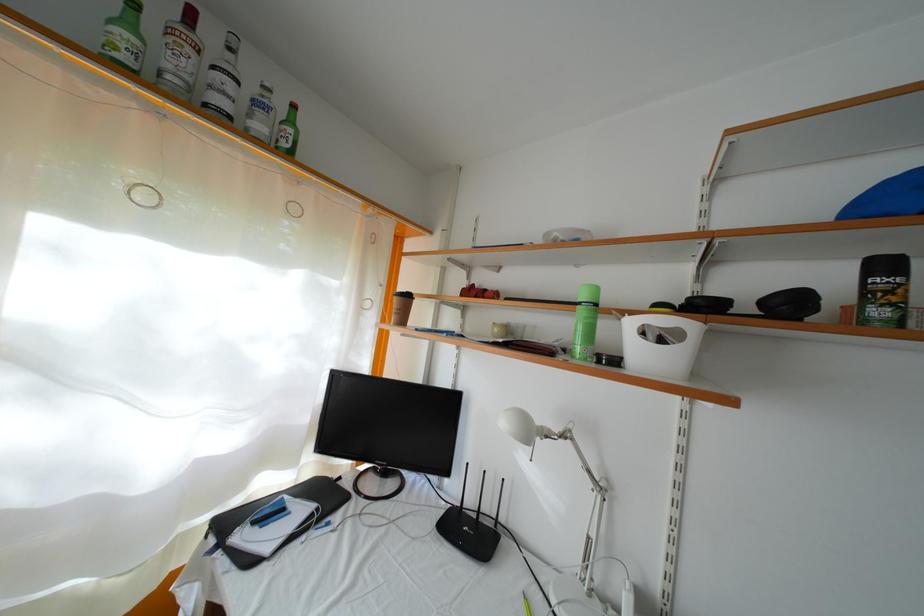
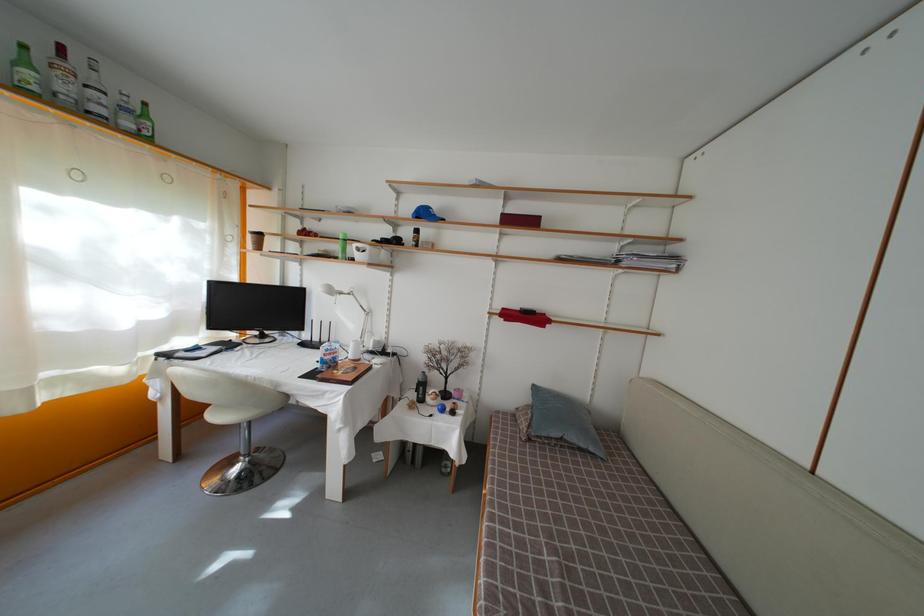
Where in the second image is the point corresponding to (134,31) from the first image?

(31, 69)